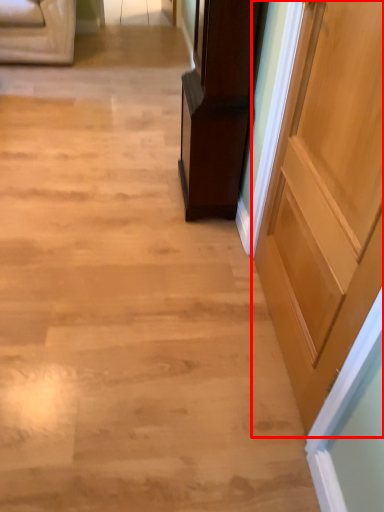
Question: Observing the image, what is the correct spatial positioning of door (annotated by the red box) in reference to furniture?

Choices:
 (A) right
 (B) left

Answer: (A)